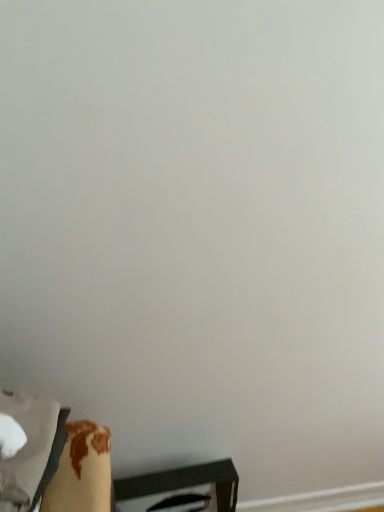
Where is `black matte shelf at lower center`? black matte shelf at lower center is located at coordinates (180, 489).

What do you see at coordinates (180, 489) in the screenshot? This screenshot has width=384, height=512. I see `black matte shelf at lower center` at bounding box center [180, 489].

Where is `black matte shelf at lower center`? black matte shelf at lower center is located at coordinates (180, 489).